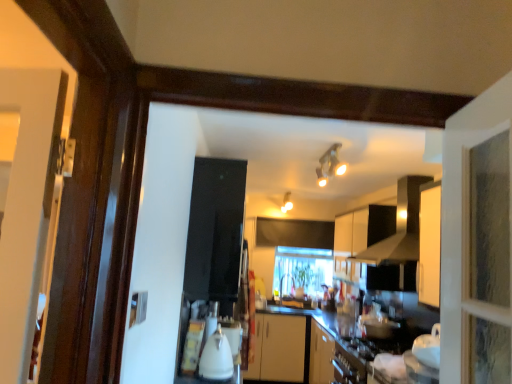
Question: From a real-world perspective, is white glossy kettle at center physically located above or below clear glass window at center?

Choices:
 (A) above
 (B) below

Answer: (B)

Question: From the image's perspective, is white glossy kettle at center above or below clear glass window at center?

Choices:
 (A) below
 (B) above

Answer: (B)

Question: Which object is positioned farthest from the matte white light fixture at upper center, acting as the 2th light fixture starting from the right?

Choices:
 (A) white glossy kettle at center
 (B) matte silver light fixture at upper center, the 2th light fixture from the back
 (C) white matte cabinet at upper center
 (D) black matte exhaust hood at upper center
 (E) clear glass window at center

Answer: (A)

Question: Considering the real-world distances, which object is closest to the matte silver light fixture at upper center, acting as the first light fixture starting from the right?

Choices:
 (A) clear glass window at center
 (B) white glossy kettle at center
 (C) matte white light fixture at upper center, the first light fixture when ordered from bottom to top
 (D) black matte exhaust hood at upper center
 (E) white matte cabinet at upper center

Answer: (D)